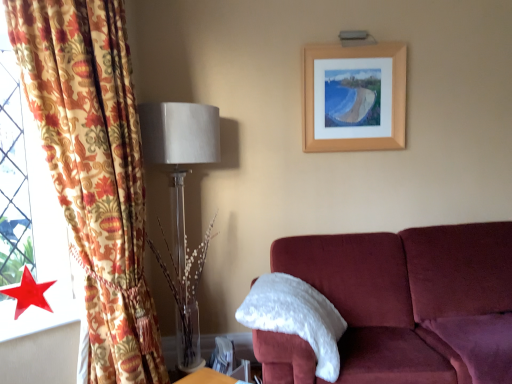
Question: Visually, is red glossy star at lower left positioned to the left or to the right of white fluffy pillow at right?

Choices:
 (A) left
 (B) right

Answer: (A)

Question: In terms of width, does red glossy star at lower left look wider or thinner when compared to white fluffy pillow at right?

Choices:
 (A) thin
 (B) wide

Answer: (A)

Question: Based on their relative distances, which object is nearer to the wooden picture frame at upper center?

Choices:
 (A) floral fabric curtain at left
 (B) red glossy star at lower left
 (C) translucent glass vase at left
 (D) white fluffy pillow at right

Answer: (C)

Question: Which of these objects is positioned farthest from the red glossy star at lower left?

Choices:
 (A) floral fabric curtain at left
 (B) white fluffy pillow at right
 (C) translucent glass vase at left
 (D) wooden picture frame at upper center

Answer: (D)